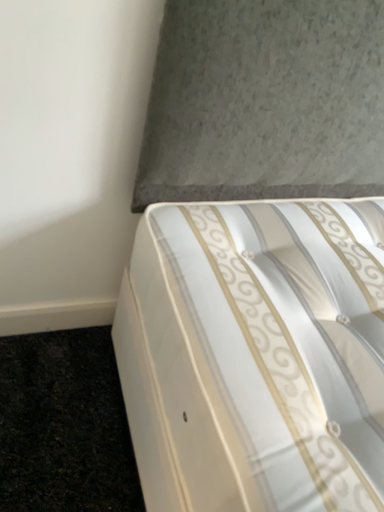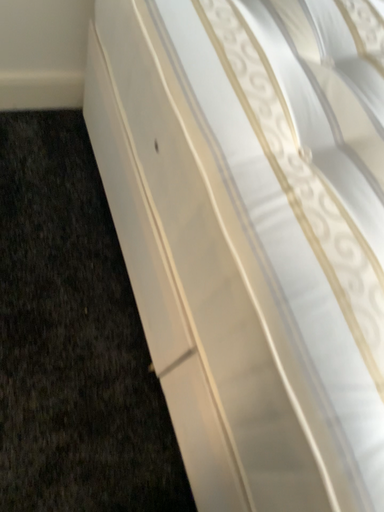
Question: How did the camera likely rotate when shooting the video?

Choices:
 (A) rotated upward
 (B) rotated downward

Answer: (B)